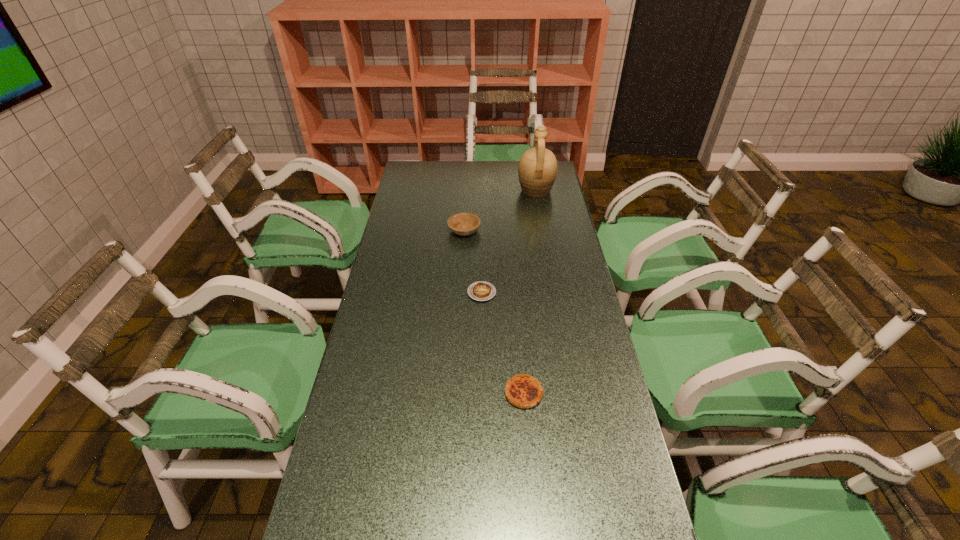
Image resolution: width=960 pixels, height=540 pixels. I want to click on the farthest object, so click(537, 170).

Where is `the tallest object`? the tallest object is located at coordinates (537, 170).

The image size is (960, 540). I want to click on the third nearest object, so click(463, 223).

Where is `bowl`? This screenshot has height=540, width=960. bowl is located at coordinates (463, 223).

Identify the location of the third tallest object. Image resolution: width=960 pixels, height=540 pixels. pyautogui.click(x=522, y=390).

Image resolution: width=960 pixels, height=540 pixels. I want to click on the nearest object, so click(522, 390).

The width and height of the screenshot is (960, 540). Identify the location of the shortest object. (481, 291).

The image size is (960, 540). In order to click on the second nearest object in this screenshot , I will do `click(481, 291)`.

Locate an element on the screen. The width and height of the screenshot is (960, 540). vacant space located 0.160m on the left of the tallest object is located at coordinates (482, 191).

Find the location of a particular element. The image size is (960, 540). vacant space located 0.390m on the front of the second farthest object is located at coordinates (461, 312).